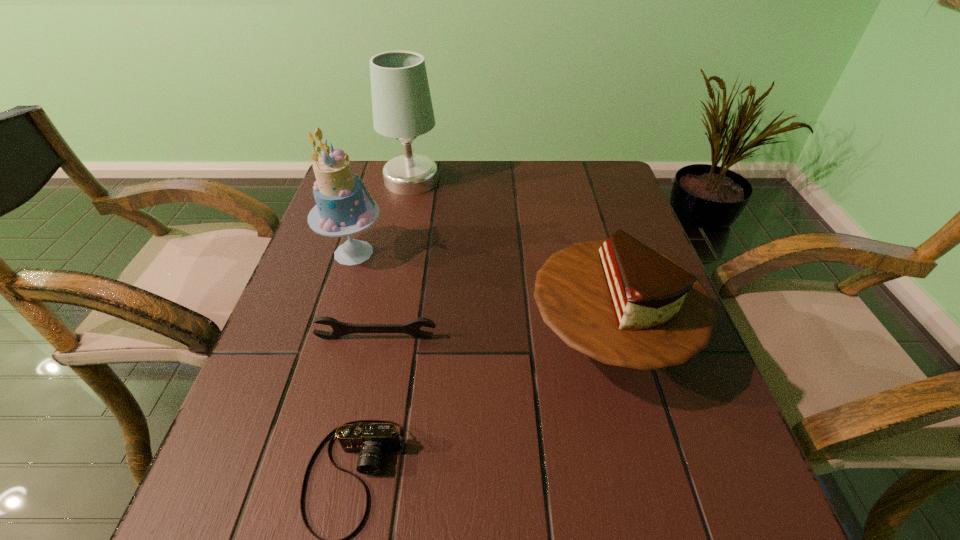
Select which object is the third closest to the left cake. Please provide its 2D coordinates. Your answer should be formatted as a tuple, i.e. [(x, y)], where the tuple contains the x and y coordinates of a point satisfying the conditions above.

[(618, 301)]

Locate an element on the screen. The width and height of the screenshot is (960, 540). free spot that satisfies the following two spatial constraints: 1. on the base of the farthest object; 2. on the right side of the shorter cake is located at coordinates (379, 338).

What are the coordinates of `vacant area that satisfies the following two spatial constraints: 1. with a ladder on the side of the shorter cake; 2. on the left side of the farther cake` in the screenshot? It's located at (327, 338).

Locate an element on the screen. The height and width of the screenshot is (540, 960). free space that satisfies the following two spatial constraints: 1. on the base of the farthest object; 2. on the back side of the nearer cake is located at coordinates (379, 338).

The height and width of the screenshot is (540, 960). Find the location of `vacant position in the image that satisfies the following two spatial constraints: 1. on the base of the rightmost object; 2. on the right side of the lampshade`. vacant position in the image that satisfies the following two spatial constraints: 1. on the base of the rightmost object; 2. on the right side of the lampshade is located at coordinates (379, 338).

Find the location of `free spot that satisfies the following two spatial constraints: 1. with a ladder on the side of the left cake; 2. on the back side of the rightmost object`. free spot that satisfies the following two spatial constraints: 1. with a ladder on the side of the left cake; 2. on the back side of the rightmost object is located at coordinates (327, 338).

Locate an element on the screen. This screenshot has width=960, height=540. vacant space that satisfies the following two spatial constraints: 1. on the base of the lampshade; 2. on the right side of the third shortest object is located at coordinates (379, 338).

Locate an element on the screen. free spot that satisfies the following two spatial constraints: 1. on the base of the lampshade; 2. on the open ends of the wrench is located at coordinates (379, 338).